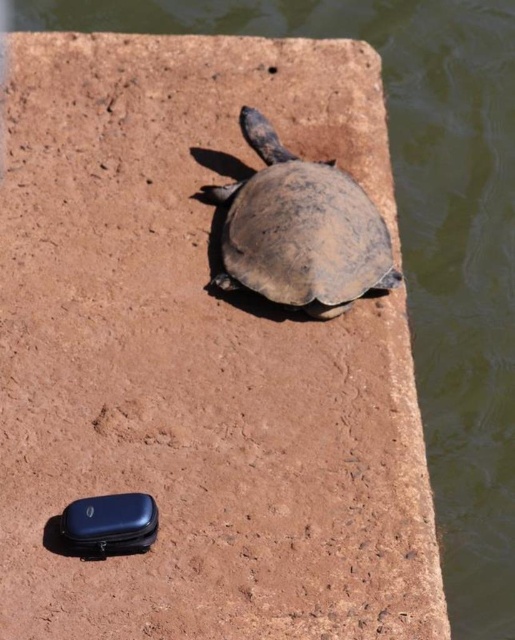
Measure the distance between brown matte tortoise at center and matte black phone case at lower left.

brown matte tortoise at center and matte black phone case at lower left are 3.49 feet apart from each other.

Between brown matte tortoise at center and matte black phone case at lower left, which one has less height?

With less height is matte black phone case at lower left.

Does point (335, 241) come closer to viewer compared to point (147, 522)?

No, it is behind (147, 522).

Locate an element on the screen. The image size is (515, 640). brown matte tortoise at center is located at coordinates (300, 230).